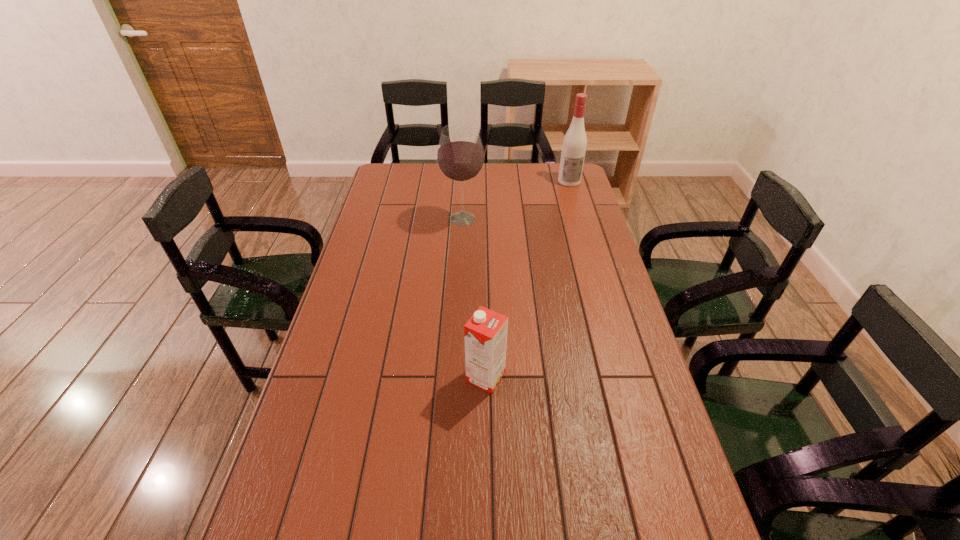
At what (x,y) coordinates should I click in order to perform the action: click on free point between the shortest object and the left alcohol. Please return your answer as a coordinate pair (x, y). The image size is (960, 540). Looking at the image, I should click on (474, 298).

This screenshot has width=960, height=540. I want to click on free area in between the left alcohol and the carton, so click(474, 298).

Locate which object is the closest to the right alcohol. Please provide its 2D coordinates. Your answer should be formatted as a tuple, i.e. [(x, y)], where the tuple contains the x and y coordinates of a point satisfying the conditions above.

[(460, 157)]

Where is `object that stands as the closest to the left alcohol`? This screenshot has height=540, width=960. object that stands as the closest to the left alcohol is located at coordinates (574, 145).

Identify the location of vacant space that satisfies the following two spatial constraints: 1. on the front side of the nearer alcohol; 2. on the right side of the shortest object. This screenshot has height=540, width=960. (454, 377).